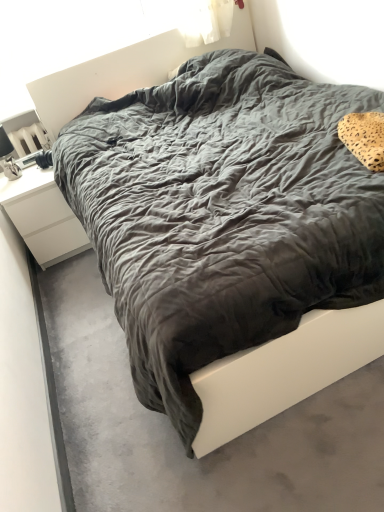
What are the coordinates of `free space above white matte nightstand at left (from a real-world perspective)` in the screenshot? It's located at (24, 174).